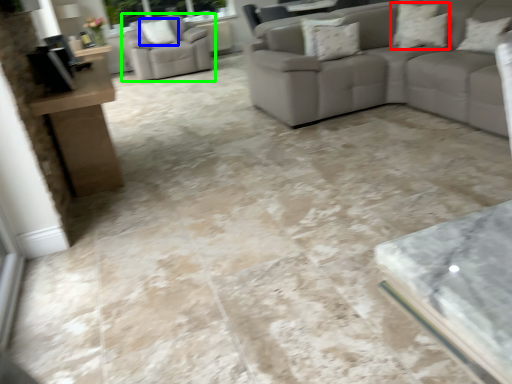
Question: Which is nearer to the pillow (highlighted by a red box)? pillow (highlighted by a blue box) or chair (highlighted by a green box).

Choices:
 (A) pillow
 (B) chair

Answer: (B)